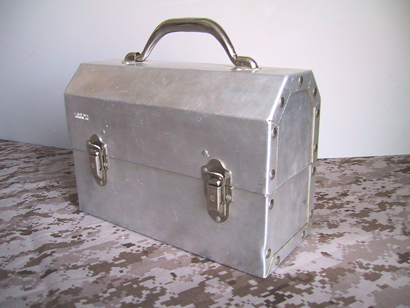
Identify the location of lock. (216, 184).